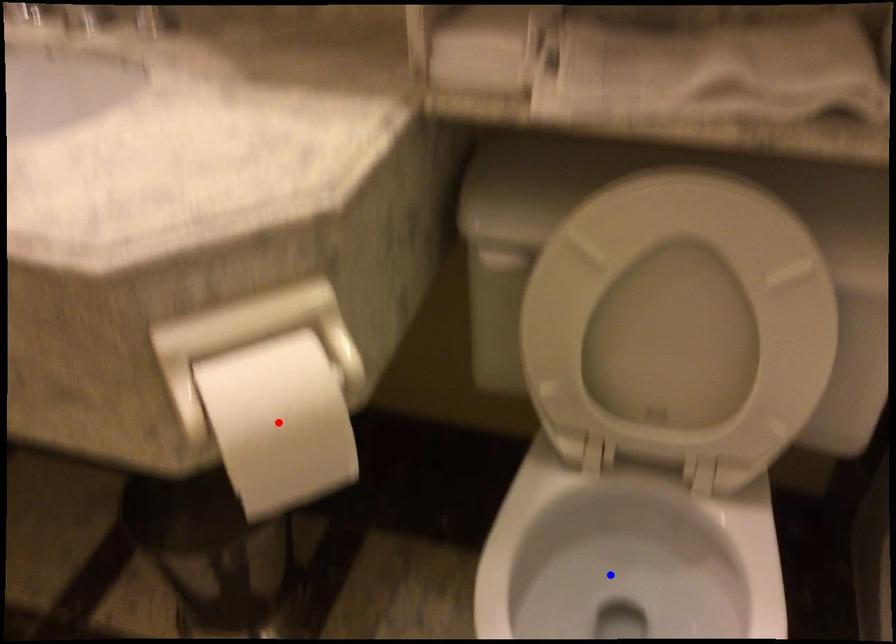
Question: Two points are marked on the image. Which point is closer to the camera?

Choices:
 (A) Blue point is closer.
 (B) Red point is closer.

Answer: (B)